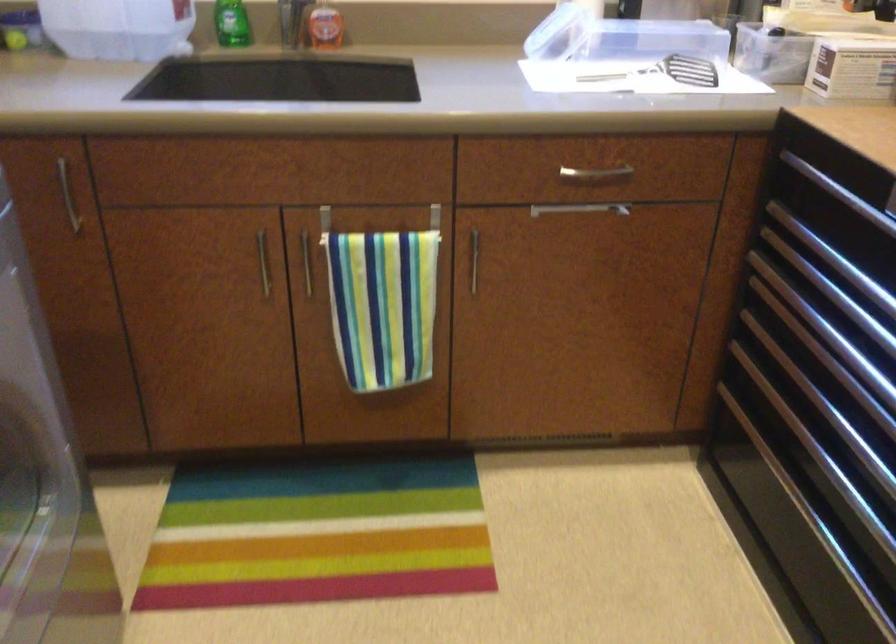
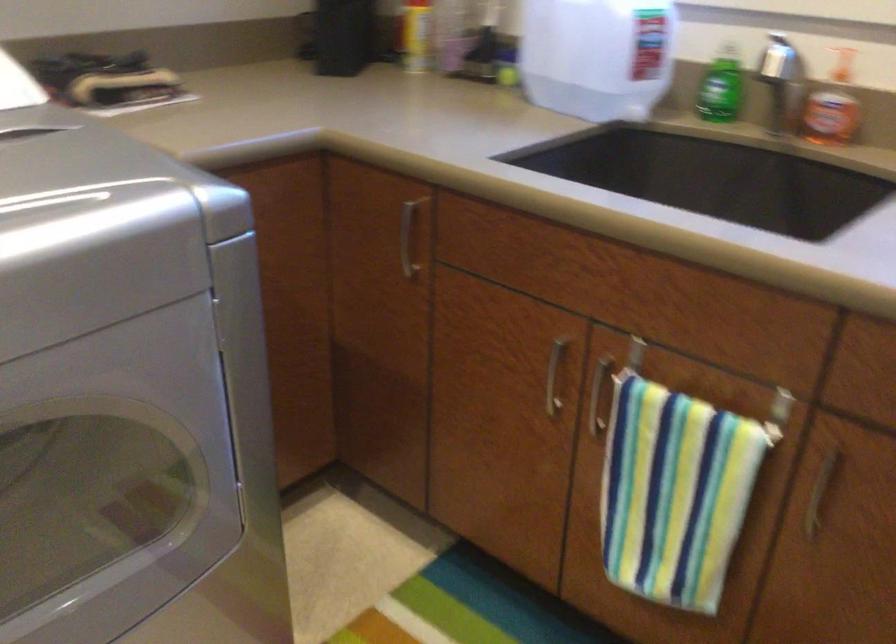
Find the pixel in the second image that matches point 254,267 in the first image.

(554, 375)